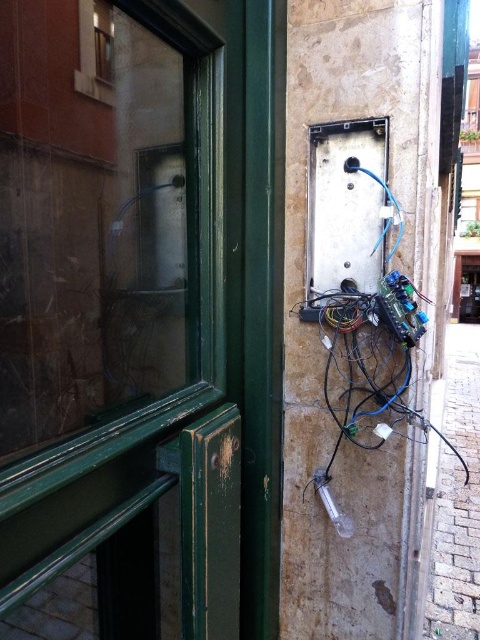
Question: Based on their relative distances, which object is farther from the metallic gray electrical box at center?

Choices:
 (A) transparent glass door at left
 (B) clear glass window at upper left

Answer: (B)

Question: Which point appears closest to the camera in this image?

Choices:
 (A) (111, 49)
 (B) (44, 579)
 (C) (321, 252)
 (D) (446, 593)

Answer: (B)

Question: Which object is closer to the camera taking this photo?

Choices:
 (A) transparent glass door at left
 (B) metallic gray electrical box at center

Answer: (A)

Question: Can you confirm if black plastic wires at lower right is bigger than clear glass window at upper left?

Choices:
 (A) no
 (B) yes

Answer: (B)

Question: Is transparent glass door at left below clear glass window at upper left?

Choices:
 (A) no
 (B) yes

Answer: (B)

Question: In this image, where is transparent glass door at left located relative to clear glass window at upper left?

Choices:
 (A) above
 (B) below

Answer: (B)